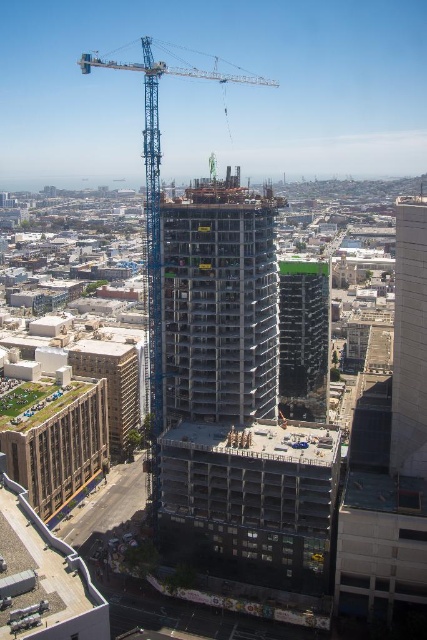
Does concrete building at center have a greater width compared to blue metallic crane at center?

Incorrect, concrete building at center's width does not surpass blue metallic crane at center's.

Locate an element on the screen. concrete building at center is located at coordinates pyautogui.click(x=219, y=304).

Identify the location of concrete building at center. This screenshot has width=427, height=640. (219, 304).

Who is more distant from viewer, (x=411, y=330) or (x=300, y=413)?

The point (x=300, y=413) is more distant.

Is point (415, 337) closer to viewer compared to point (284, 268)?

Yes.

Which is in front, point (417, 422) or point (312, 356)?

Point (417, 422)

Image resolution: width=427 pixels, height=640 pixels. I want to click on white concrete building at right, so click(409, 340).

Which is in front, point (313, 273) or point (152, 385)?

Positioned in front is point (152, 385).

This screenshot has height=640, width=427. I want to click on black glass building at center, so click(304, 337).

Which is in front, point (283, 403) or point (155, 387)?

Point (155, 387) is in front.

Identify the location of black glass building at center. (304, 337).